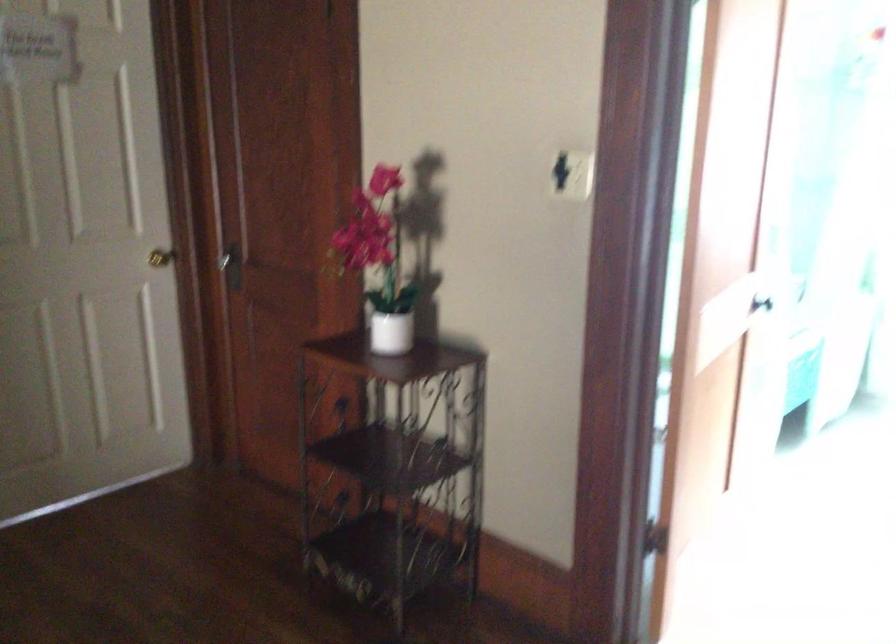
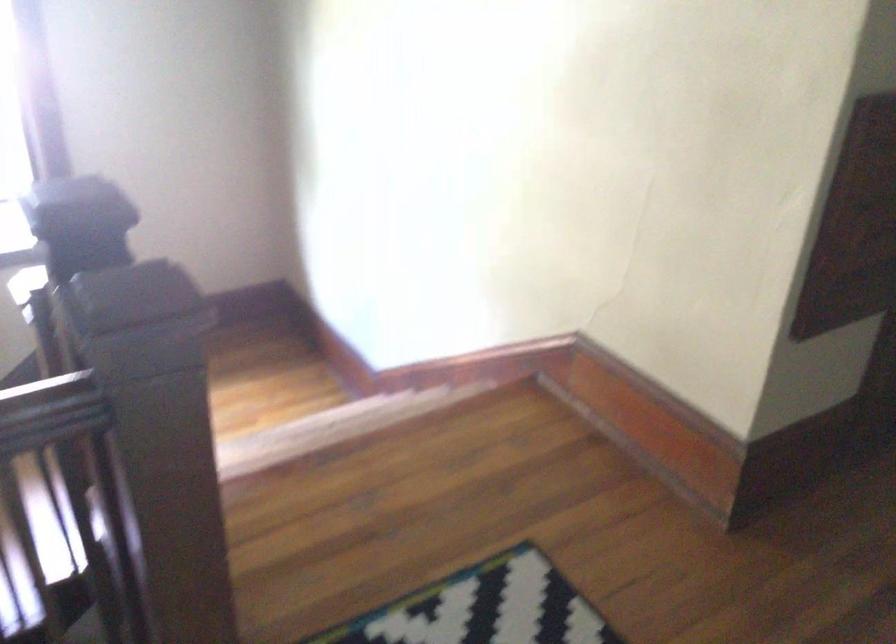
Looking at this image, based on the continuous images, in which direction is the camera rotating?

The camera's rotation is toward left-down.